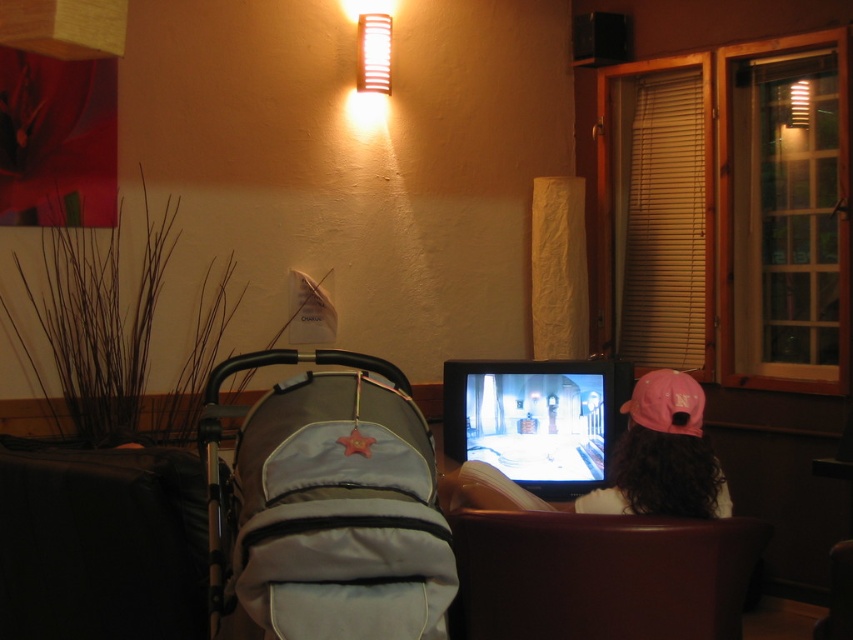
Question: Estimate the real-world distances between objects in this image. Which object is closer to the brown leather armchair at lower center?

Choices:
 (A) pink fabric cap at upper right
 (B) pink fabric baseball cap at right

Answer: (A)

Question: Is brown leather armchair at lower center closer to the viewer compared to pink fabric baseball cap at right?

Choices:
 (A) no
 (B) yes

Answer: (B)

Question: Can you confirm if light gray fabric baby carriage at center-left is positioned to the left of pink fabric cap at upper right?

Choices:
 (A) no
 (B) yes

Answer: (B)

Question: Which of the following is the closest to the observer?

Choices:
 (A) (297, 572)
 (B) (584, 566)
 (C) (660, 388)
 (D) (701, 419)

Answer: (A)

Question: Is brown leather armchair at lower center thinner than pink fabric cap at upper right?

Choices:
 (A) yes
 (B) no

Answer: (B)

Question: Which of these objects is positioned farthest from the brown leather armchair at lower center?

Choices:
 (A) pink fabric cap at upper right
 (B) pink fabric baseball cap at right
 (C) light gray fabric baby carriage at center-left

Answer: (C)